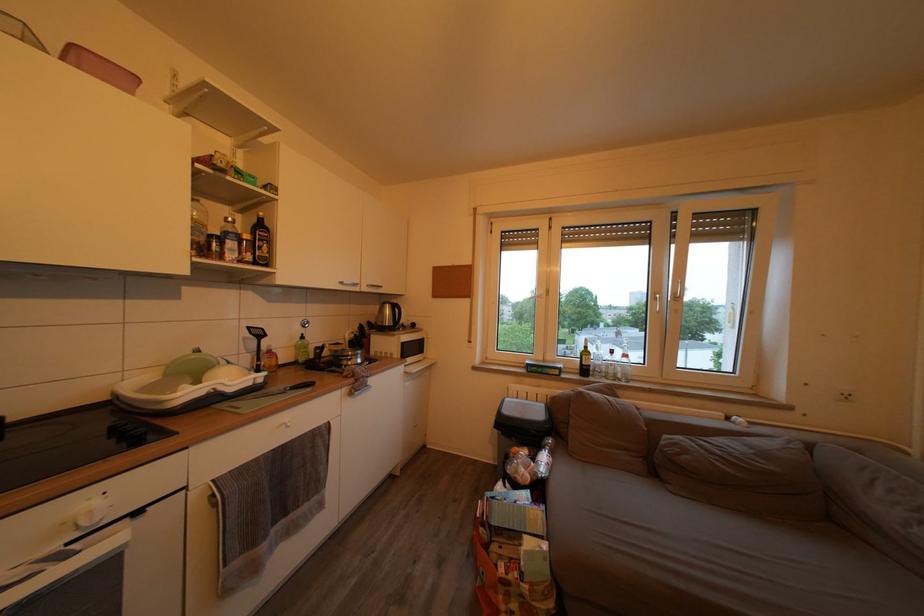
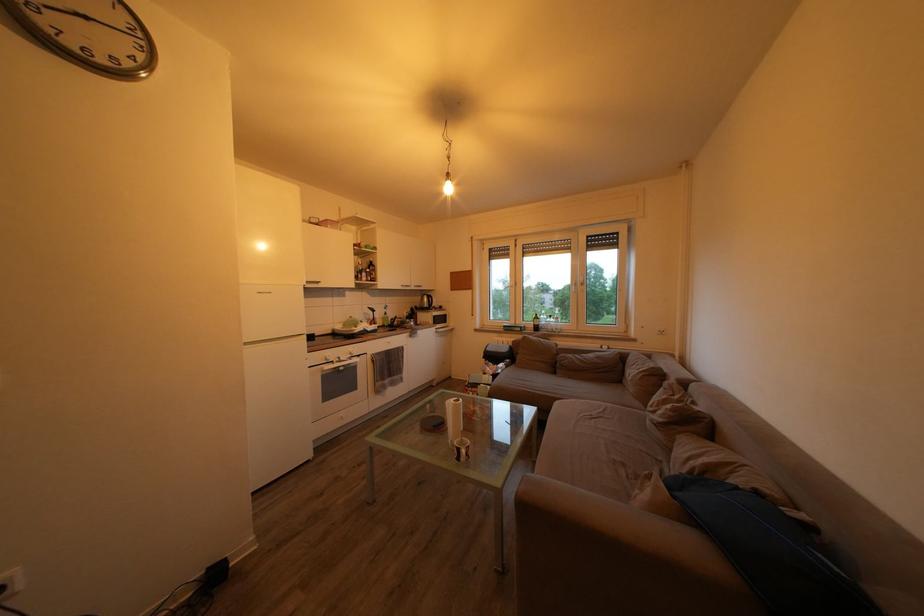
Locate, in the second image, the point that corresponds to the point at 558,233 in the first image.

(524, 252)